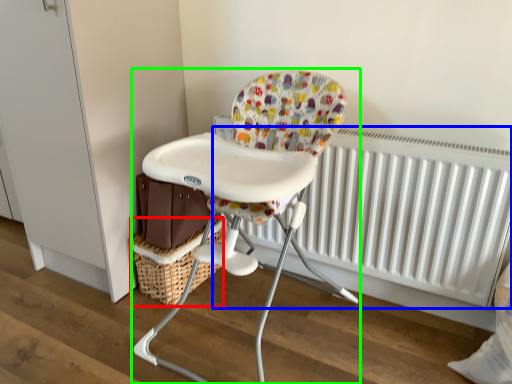
Question: Estimate the real-world distances between objects in this image. Which object is farther from basket (highlighted by a red box), radiator (highlighted by a blue box) or chair (highlighted by a green box)?

Choices:
 (A) radiator
 (B) chair

Answer: (A)